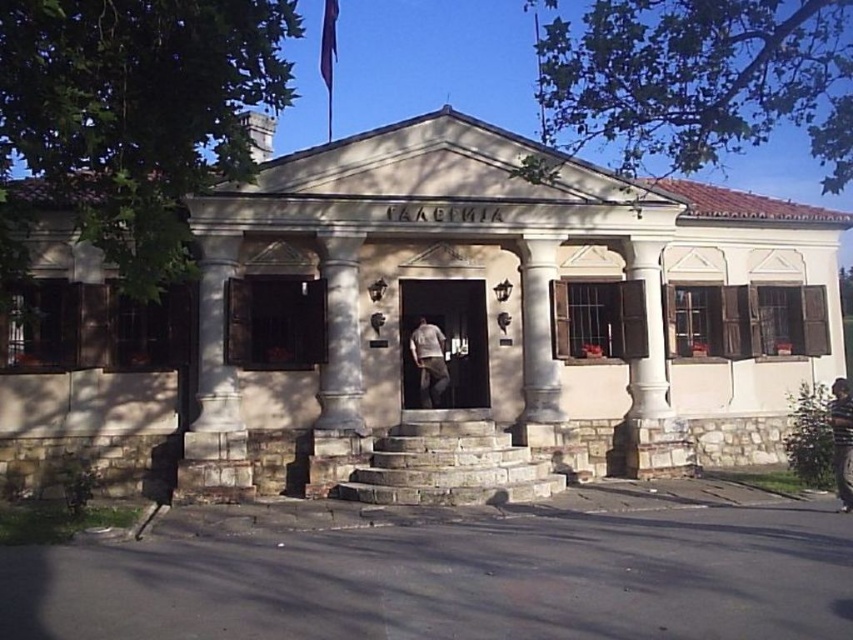
Does white marble column at center appear under brown leather jacket at lower right?

Incorrect, white marble column at center is not positioned below brown leather jacket at lower right.

Consider the image. Does white marble column at center have a lesser height compared to brown leather jacket at lower right?

Incorrect, white marble column at center's height does not fall short of brown leather jacket at lower right's.

What do you see at coordinates (538, 332) in the screenshot? The width and height of the screenshot is (853, 640). I see `white marble column at center` at bounding box center [538, 332].

You are a GUI agent. You are given a task and a screenshot of the screen. Output one action in this format:
    pyautogui.click(x=<x>, y=<y>)
    Task: Click on the white marble column at center
    Image resolution: width=853 pixels, height=640 pixels.
    Given the screenshot: What is the action you would take?
    pyautogui.click(x=538, y=332)

Who is more forward, (525, 252) or (444, 349)?

Positioned in front is point (525, 252).

Consider the image. Is white marble column at center closer to camera compared to white cotton shirt at center?

Yes.

Find the location of a particular element. The width and height of the screenshot is (853, 640). white marble column at center is located at coordinates (538, 332).

Does point (431, 364) come in front of point (849, 490)?

No, (431, 364) is behind (849, 490).

Between white cotton shirt at center and brown leather jacket at lower right, which one appears on the left side from the viewer's perspective?

white cotton shirt at center

Where is `white cotton shirt at center`? Image resolution: width=853 pixels, height=640 pixels. white cotton shirt at center is located at coordinates (428, 362).